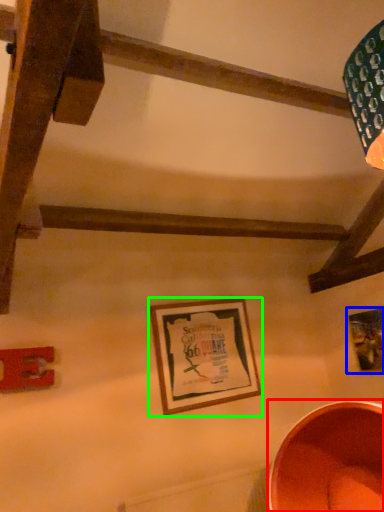
Question: Considering the real-world distances, which object is closest to basin (highlighted by a red box)? picture frame (highlighted by a blue box) or picture frame (highlighted by a green box).

Choices:
 (A) picture frame
 (B) picture frame

Answer: (A)